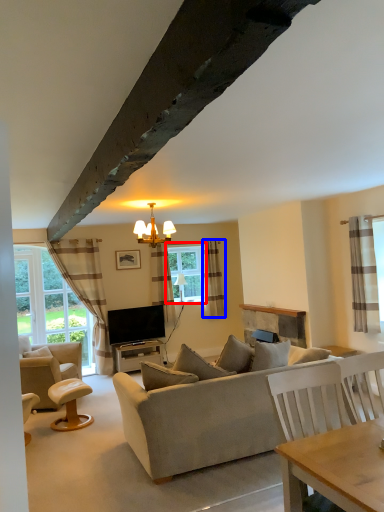
Question: Which point is further to the camera, window (highlighted by a red box) or curtain (highlighted by a blue box)?

Choices:
 (A) window
 (B) curtain

Answer: (A)